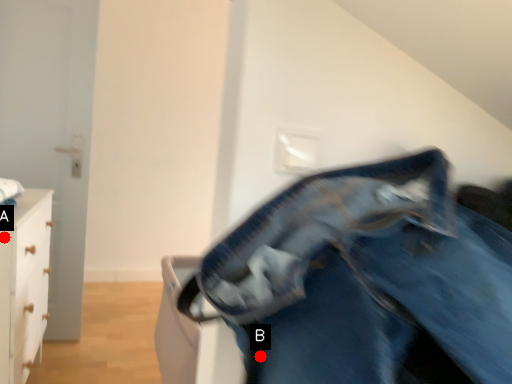
Question: Two points are circled on the image, labeled by A and B beside each circle. Which of the following is the farthest from the observer?

Choices:
 (A) A is further
 (B) B is further

Answer: (A)